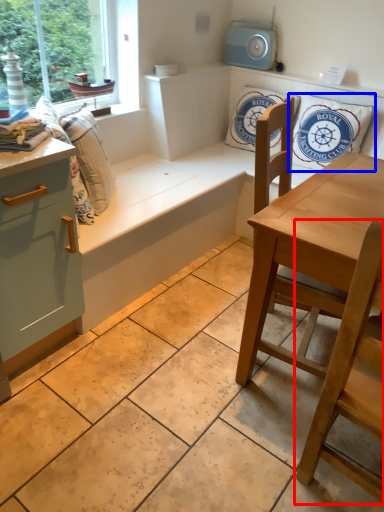
Question: Which object appears closest to the camera in this image, chair (highlighted by a red box) or pillow (highlighted by a blue box)?

Choices:
 (A) chair
 (B) pillow

Answer: (A)